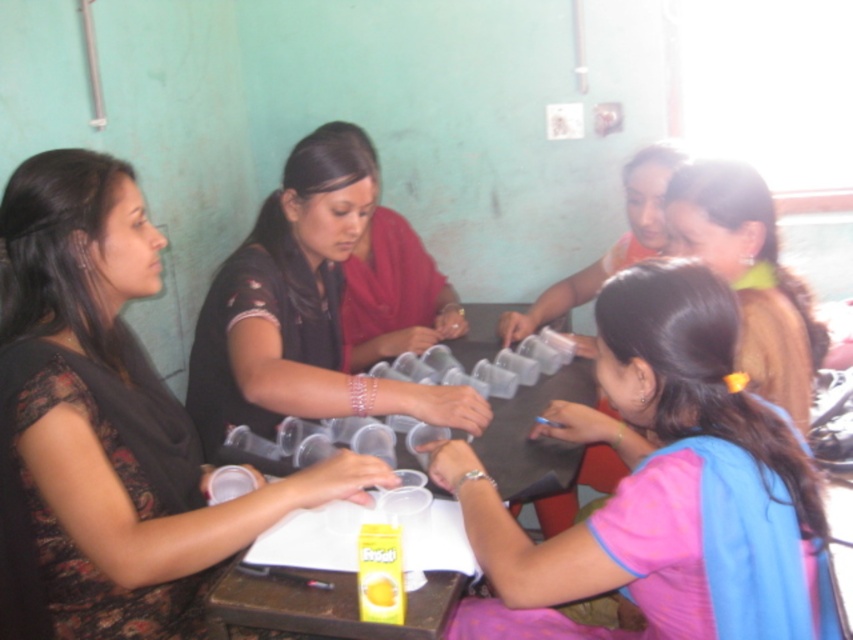
Question: Is black matte shirt at center wider than brown fabric hair tie at upper right?

Choices:
 (A) yes
 (B) no

Answer: (A)

Question: Which object appears closest to the camera in this image?

Choices:
 (A) brown fabric hair tie at upper right
 (B) black fabric shirt at left
 (C) pink fabric at center

Answer: (C)

Question: Can you confirm if black fabric shirt at left is thinner than pink fabric at center?

Choices:
 (A) no
 (B) yes

Answer: (A)

Question: Estimate the real-world distances between objects in this image. Which object is closer to the transparent plastic cups at center?

Choices:
 (A) black fabric shirt at left
 (B) brown fabric hair tie at upper right
 (C) translucent plastic juice at center

Answer: (B)

Question: Can you confirm if black fabric shirt at left is positioned to the left of translucent plastic juice at center?

Choices:
 (A) yes
 (B) no

Answer: (A)

Question: Which point appears closest to the camera in this image?

Choices:
 (A) (399, 556)
 (B) (67, 609)
 (C) (780, 387)
 (D) (786, 625)

Answer: (D)